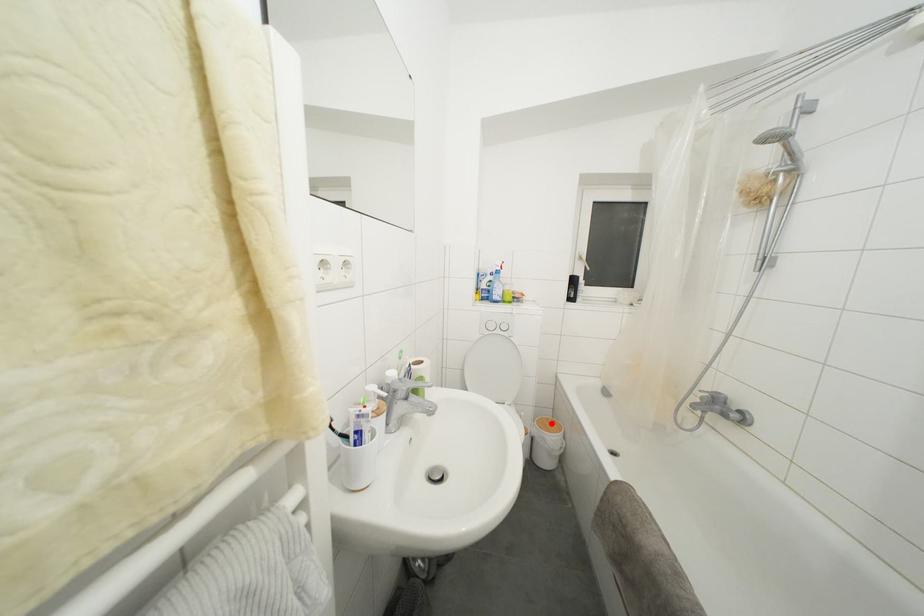
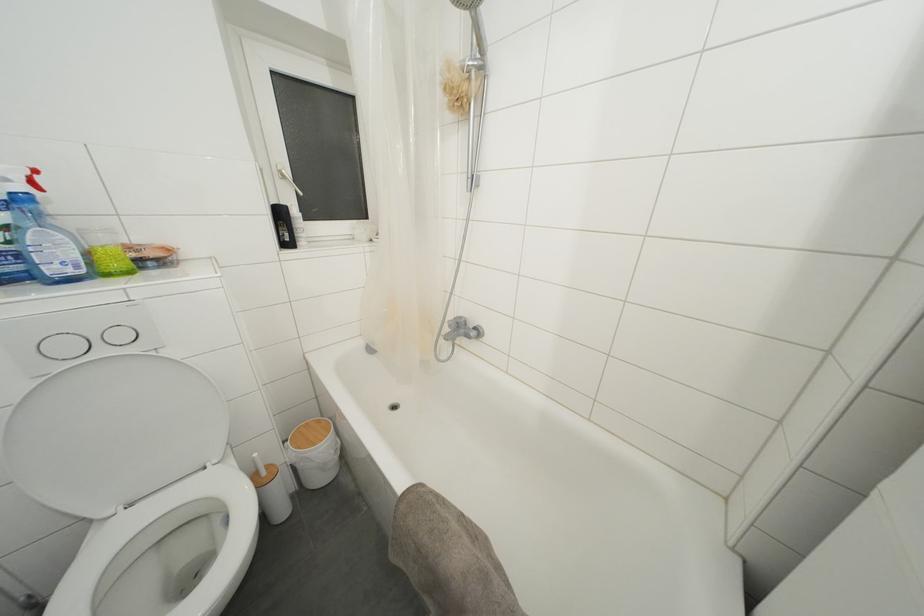
Question: I am providing you with two images of the same scene from different viewpoints. Image1 has a red point marked. In image2, the corresponding 3D location appears at what relative position? Reply with the corresponding letter.

Choices:
 (A) Closer
 (B) Farther

Answer: (B)